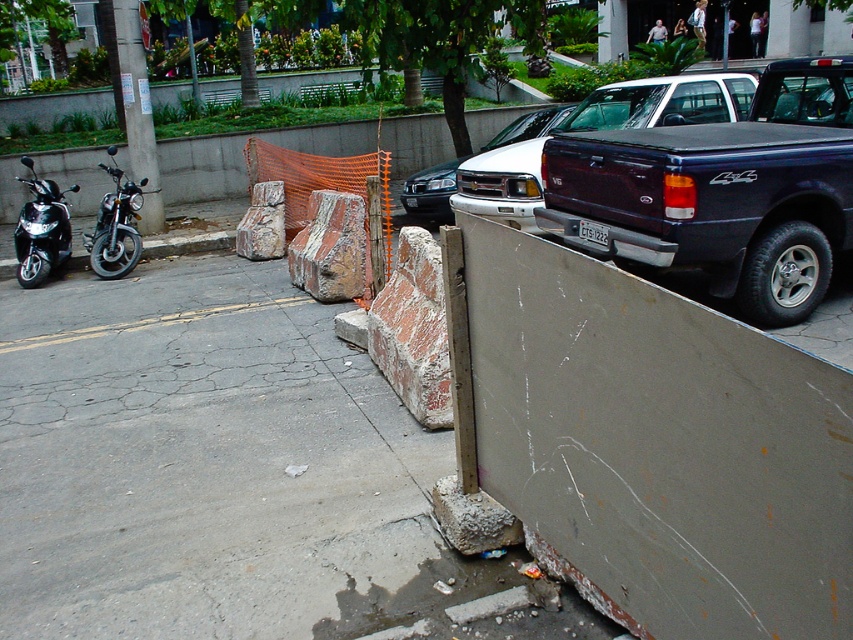
Question: Is gray concrete pavement at lower left smaller than dark purple glossy truck at right?

Choices:
 (A) no
 (B) yes

Answer: (A)

Question: Can you confirm if dark purple glossy truck at right is smaller than shiny black motorcycle at left?

Choices:
 (A) no
 (B) yes

Answer: (A)

Question: Can you confirm if gray concrete pavement at lower left is positioned to the left of dark purple glossy truck at right?

Choices:
 (A) yes
 (B) no

Answer: (A)

Question: Among these points, which one is farthest from the camera?

Choices:
 (A) (331, 209)
 (B) (44, 211)

Answer: (B)

Question: Which is farther from the dark blue matte truck at right?

Choices:
 (A) white glossy truck at center
 (B) rusty concrete block at center

Answer: (A)

Question: Among these points, which one is farthest from the camera?

Choices:
 (A) (32, 182)
 (B) (279, 232)
 (C) (314, 259)

Answer: (A)